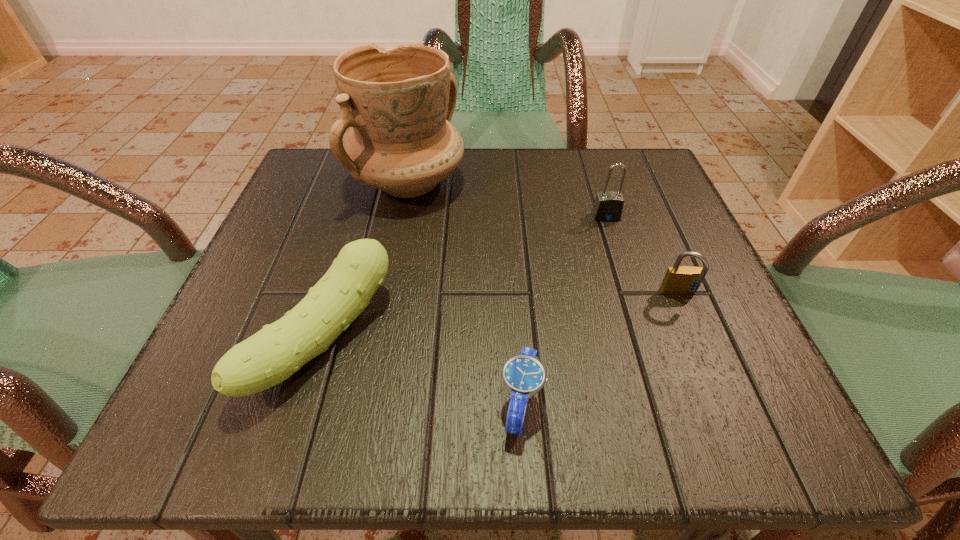
At what (x,y) coordinates should I click in order to perform the action: click on free spot between the left padlock and the right padlock. Please return your answer as a coordinate pair (x, y). This screenshot has height=540, width=960. Looking at the image, I should click on (642, 255).

This screenshot has width=960, height=540. In order to click on vacant region between the shortest object and the cucumber in this screenshot , I will do `click(422, 371)`.

Where is `empty location between the third object from right to left and the farther padlock`? The height and width of the screenshot is (540, 960). empty location between the third object from right to left and the farther padlock is located at coordinates (564, 310).

Image resolution: width=960 pixels, height=540 pixels. Find the location of `vacant region between the shortest object and the cucumber`. vacant region between the shortest object and the cucumber is located at coordinates (422, 371).

Locate an element on the screen. The height and width of the screenshot is (540, 960). vacant area between the cucumber and the right padlock is located at coordinates (501, 317).

Identify the location of vacant area that lies between the shortest object and the shorter padlock. (600, 349).

You are a GUI agent. You are given a task and a screenshot of the screen. Output one action in this format:
    pyautogui.click(x=<x>, y=<y>)
    Task: Click on the blank region between the watch and the farther padlock
    The height and width of the screenshot is (540, 960).
    Given the screenshot: What is the action you would take?
    pyautogui.click(x=564, y=310)

This screenshot has width=960, height=540. I want to click on object that can be found as the third closest to the shorter padlock, so click(399, 102).

This screenshot has width=960, height=540. Identify the location of object that is the fourth closest to the cucumber. (683, 280).